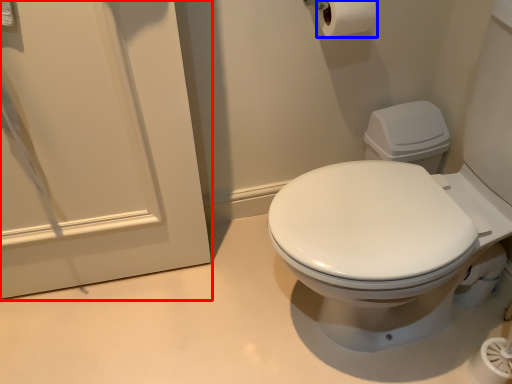
Question: Which object is closer to the camera taking this photo, screen door (highlighted by a red box) or toilet paper (highlighted by a blue box)?

Choices:
 (A) screen door
 (B) toilet paper

Answer: (A)